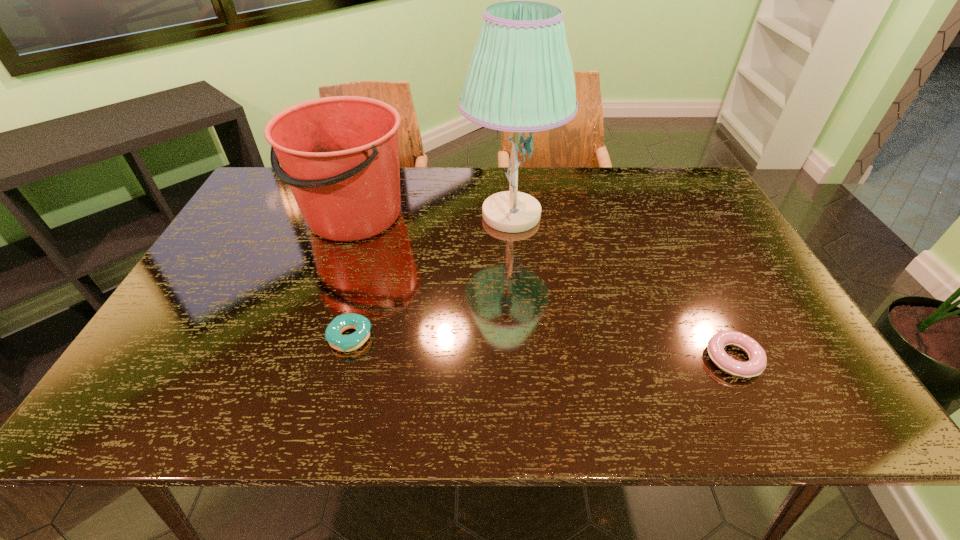
The image size is (960, 540). I want to click on vacant point located between the third object from left to right and the third shortest object, so click(x=432, y=215).

At what (x,y) coordinates should I click in order to perform the action: click on free space between the left doughnut and the bucket. Please return your answer as a coordinate pair (x, y). The image size is (960, 540). Looking at the image, I should click on (351, 276).

Locate an element on the screen. Image resolution: width=960 pixels, height=540 pixels. free space between the tallest object and the rightmost object is located at coordinates (622, 287).

This screenshot has height=540, width=960. I want to click on empty space between the second object from right to left and the right doughnut, so click(622, 287).

Locate an element on the screen. The width and height of the screenshot is (960, 540). free space that is in between the left doughnut and the rightmost object is located at coordinates (541, 348).

At what (x,y) coordinates should I click in order to perform the action: click on free space between the left doughnut and the rightmost object. Please return your answer as a coordinate pair (x, y). Looking at the image, I should click on (541, 348).

Locate an element on the screen. This screenshot has width=960, height=540. the closest object to the bucket is located at coordinates (520, 78).

Point out which object is positioned as the nearest to the bucket. Please provide its 2D coordinates. Your answer should be formatted as a tuple, i.e. [(x, y)], where the tuple contains the x and y coordinates of a point satisfying the conditions above.

[(520, 78)]

Where is `vacant area in the image that satisfies the following two spatial constraints: 1. on the back side of the lamp; 2. on the right side of the left doughnut`? vacant area in the image that satisfies the following two spatial constraints: 1. on the back side of the lamp; 2. on the right side of the left doughnut is located at coordinates (383, 215).

At what (x,y) coordinates should I click in order to perform the action: click on free space that satisfies the following two spatial constraints: 1. on the back side of the left doughnut; 2. on the right side of the lamp. Please return your answer as a coordinate pair (x, y). Looking at the image, I should click on (383, 215).